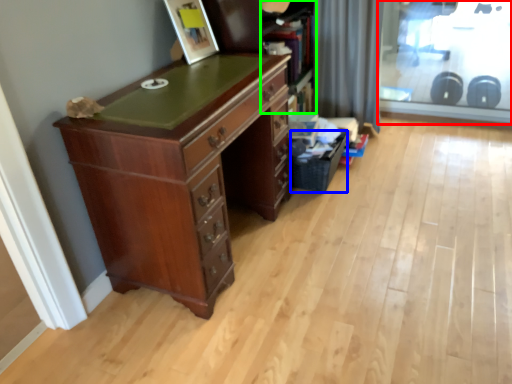
Question: Based on their relative distances, which object is farther from screen door (highlighted by a red box)? Choose from basket (highlighted by a blue box) and bookshelf (highlighted by a green box).

Choices:
 (A) basket
 (B) bookshelf

Answer: (A)